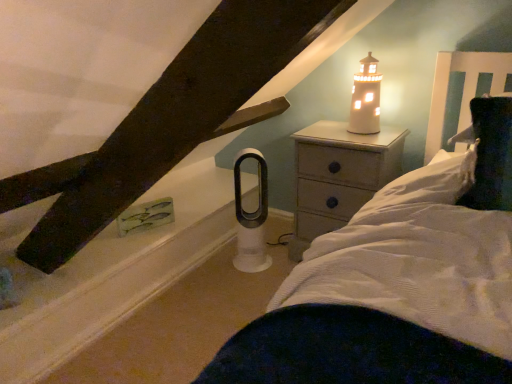
Question: Can white matte window sill at lower left be found inside wooden nightstand at upper right?

Choices:
 (A) yes
 (B) no

Answer: (B)

Question: Considering the relative positions of wooden nightstand at upper right and white matte window sill at lower left in the image provided, is wooden nightstand at upper right to the left of white matte window sill at lower left from the viewer's perspective?

Choices:
 (A) no
 (B) yes

Answer: (A)

Question: Is wooden nightstand at upper right thinner than white matte window sill at lower left?

Choices:
 (A) yes
 (B) no

Answer: (A)

Question: From the image's perspective, is wooden nightstand at upper right on white matte window sill at lower left?

Choices:
 (A) yes
 (B) no

Answer: (A)

Question: Can you confirm if wooden nightstand at upper right is smaller than white matte window sill at lower left?

Choices:
 (A) no
 (B) yes

Answer: (A)

Question: Considering the positions of white ceramic lighthouse at upper right and white matte window sill at lower left in the image, is white ceramic lighthouse at upper right wider or thinner than white matte window sill at lower left?

Choices:
 (A) thin
 (B) wide

Answer: (A)

Question: Is white ceramic lighthouse at upper right spatially inside white matte window sill at lower left, or outside of it?

Choices:
 (A) inside
 (B) outside

Answer: (B)

Question: From a real-world perspective, is white ceramic lighthouse at upper right above or below white matte window sill at lower left?

Choices:
 (A) below
 (B) above

Answer: (B)

Question: Is white ceramic lighthouse at upper right in front of or behind white matte window sill at lower left in the image?

Choices:
 (A) behind
 (B) front

Answer: (A)

Question: Is white ceramic lighthouse at upper right in front of or behind wooden nightstand at upper right in the image?

Choices:
 (A) behind
 (B) front

Answer: (A)

Question: Which is correct: white ceramic lighthouse at upper right is inside wooden nightstand at upper right, or outside of it?

Choices:
 (A) outside
 (B) inside

Answer: (A)

Question: From the image's perspective, is white ceramic lighthouse at upper right above or below wooden nightstand at upper right?

Choices:
 (A) above
 (B) below

Answer: (A)

Question: From a real-world perspective, is white ceramic lighthouse at upper right physically located above or below wooden nightstand at upper right?

Choices:
 (A) below
 (B) above

Answer: (B)

Question: Is wooden nightstand at upper right bigger or smaller than white ceramic lighthouse at upper right?

Choices:
 (A) small
 (B) big

Answer: (B)

Question: Is wooden nightstand at upper right inside the boundaries of white ceramic lighthouse at upper right, or outside?

Choices:
 (A) inside
 (B) outside

Answer: (B)